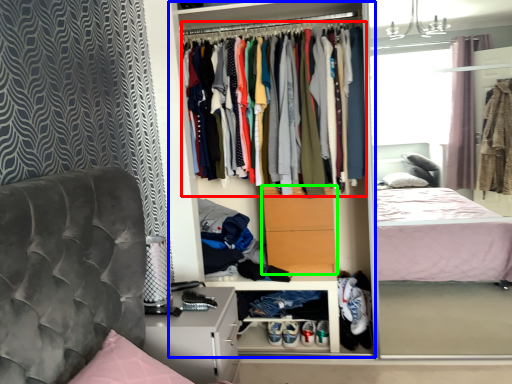
Question: Which object is the closest to the clothing (highlighted by a red box)? Choose among these: dresser (highlighted by a blue box) or drawer (highlighted by a green box).

Choices:
 (A) dresser
 (B) drawer

Answer: (B)